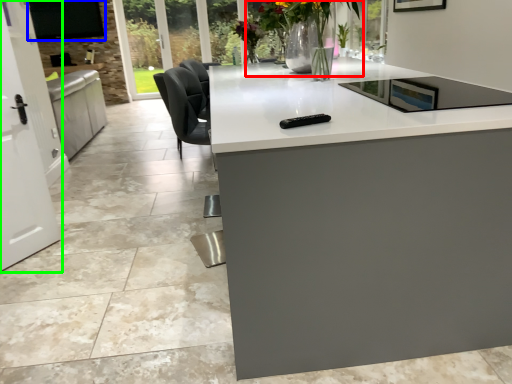
Question: Which object is the farthest from floral arrangement (highlighted by a red box)? Choose among these: window screen (highlighted by a blue box) or screen door (highlighted by a green box).

Choices:
 (A) window screen
 (B) screen door

Answer: (A)